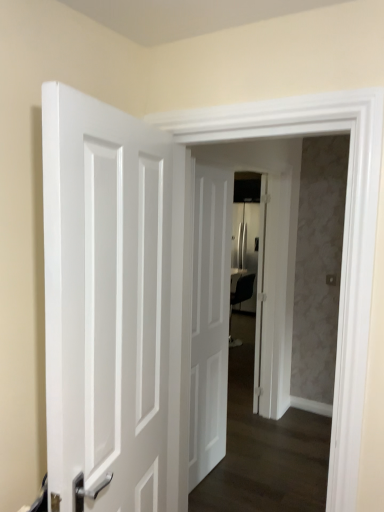
Question: In the image, is white glossy door at center positioned in front of or behind white matte door at center, positioned as the 2th door in left-to-right order?

Choices:
 (A) behind
 (B) front

Answer: (B)

Question: Is point (193, 370) positioned closer to the camera than point (221, 365)?

Choices:
 (A) farther
 (B) closer

Answer: (B)

Question: Which is farther from the white glossy door at left, the first door when ordered from front to back?

Choices:
 (A) white matte door at center, placed as the second door when sorted from right to left
 (B) white glossy door at center
 (C) white glossy door at center, positioned as the third door in left-to-right order

Answer: (C)

Question: Based on their relative distances, which object is farther from the white glossy door at left, the first door when ordered from front to back?

Choices:
 (A) white matte door at center, positioned as the 2th door in left-to-right order
 (B) white glossy door at center
 (C) white glossy door at center, positioned as the third door in left-to-right order

Answer: (C)